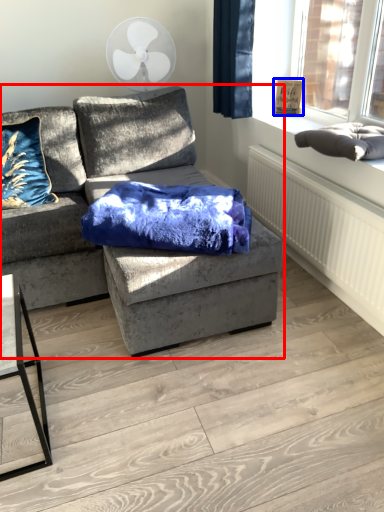
Question: Among these objects, which one is farthest to the camera, studio couch (highlighted by a red box) or picture frame (highlighted by a blue box)?

Choices:
 (A) studio couch
 (B) picture frame

Answer: (B)